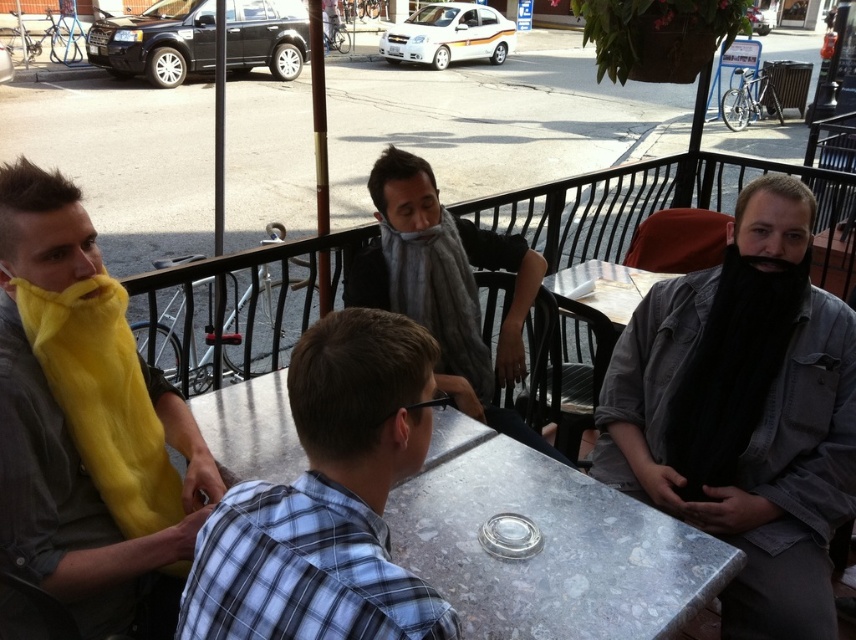
From the picture: You are standing at the edge of the patio looking towards the table. Which of the two points, point (x=742, y=518) or point (x=238, y=516), is closer to you?

Point (x=742, y=518) is closer to you because it is further to the viewer than point (x=238, y=516).

From the picture: You are a server at the cafe and need to place a large dessert plate on the table. The plate is too big for the black fuzzy beard at right to fit underneath. Can you confirm if the metallic gray table at center has enough space for the dessert plate without disturbing the beard?

The metallic gray table at center has a larger size compared to the black fuzzy beard at right, so there should be sufficient space to place the dessert plate without disturbing the beard.

Where is the black matte beard at right located in the image?

The black matte beard at right is located at point coordinates of 0.645 on the x axis and 0.870 on the y axis.